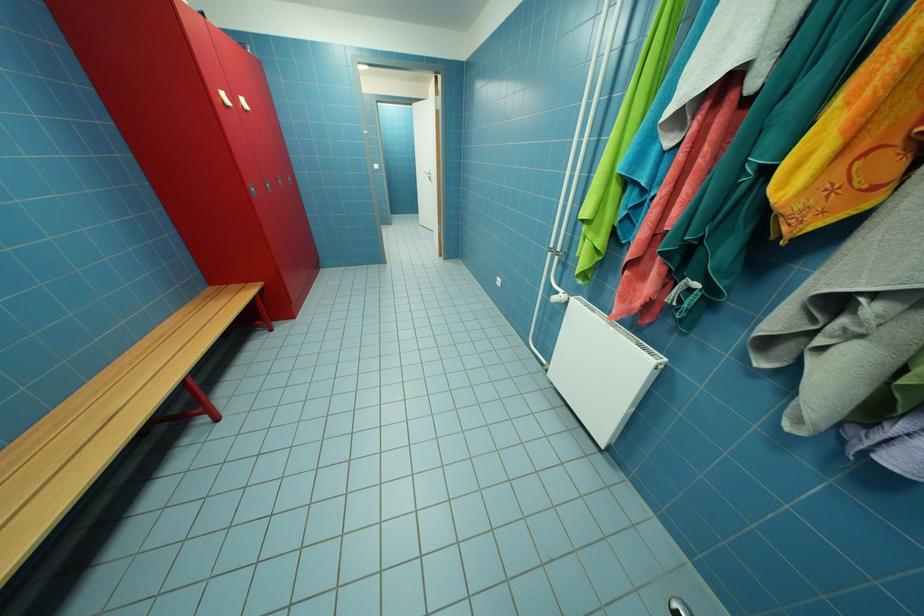
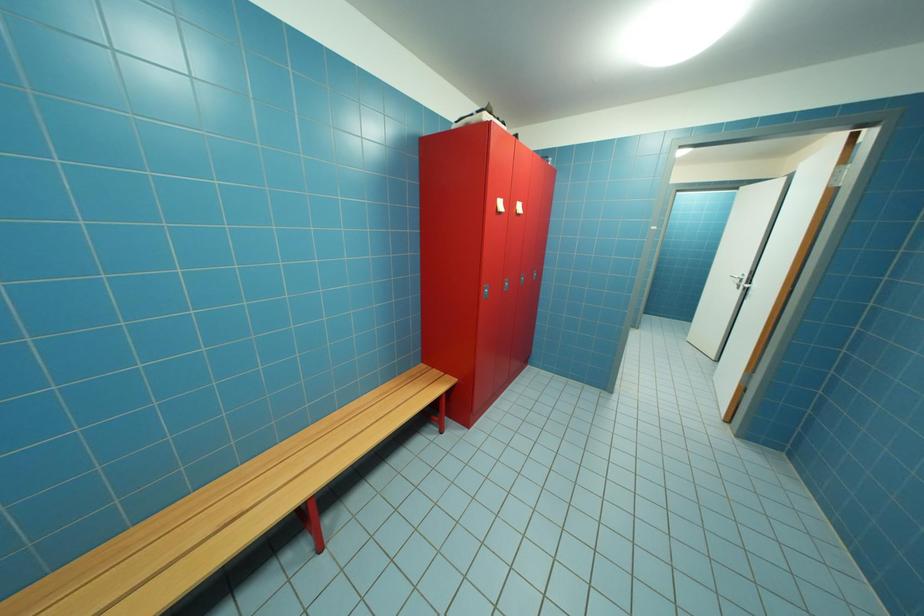
Question: The first image is from the beginning of the video and the second image is from the end. How did the camera likely rotate when shooting the video?

Choices:
 (A) Left
 (B) Right
 (C) Up
 (D) Down

Answer: (A)